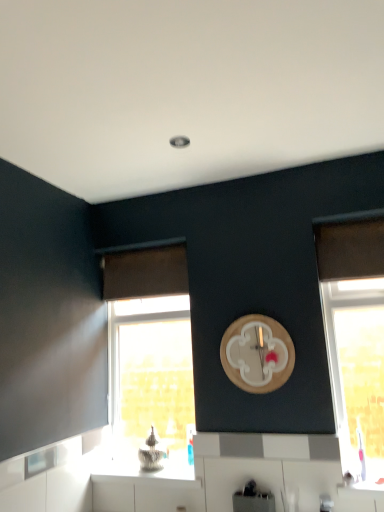
Question: Can you confirm if clear glass window at lower left, positioned as the first window in left-to-right order, is positioned to the left of metallic silver toaster at lower center?

Choices:
 (A) no
 (B) yes

Answer: (B)

Question: Does clear glass window at lower left, the second window positioned from the front, have a greater width compared to metallic silver toaster at lower center?

Choices:
 (A) no
 (B) yes

Answer: (A)

Question: From the image's perspective, is clear glass window at lower left, positioned as the first window in left-to-right order, over metallic silver toaster at lower center?

Choices:
 (A) no
 (B) yes

Answer: (B)

Question: Can you confirm if clear glass window at lower left, the second window positioned from the front, is shorter than metallic silver toaster at lower center?

Choices:
 (A) no
 (B) yes

Answer: (A)

Question: Is clear glass window at lower left, positioned as the first window in left-to-right order, to the right of metallic silver toaster at lower center from the viewer's perspective?

Choices:
 (A) no
 (B) yes

Answer: (A)

Question: Considering the positions of wooden clock at upper center and white glossy countertop at lower center in the image, is wooden clock at upper center bigger or smaller than white glossy countertop at lower center?

Choices:
 (A) big
 (B) small

Answer: (B)

Question: From the image's perspective, is wooden clock at upper center located above or below white glossy countertop at lower center?

Choices:
 (A) above
 (B) below

Answer: (A)

Question: In terms of width, does wooden clock at upper center look wider or thinner when compared to white glossy countertop at lower center?

Choices:
 (A) thin
 (B) wide

Answer: (A)

Question: From a real-world perspective, is wooden clock at upper center above or below white glossy countertop at lower center?

Choices:
 (A) below
 (B) above

Answer: (B)

Question: Considering the positions of clear glass window at lower left, positioned as the first window in left-to-right order, and brown fabric curtain at upper left in the image, is clear glass window at lower left, positioned as the first window in left-to-right order, bigger or smaller than brown fabric curtain at upper left?

Choices:
 (A) big
 (B) small

Answer: (A)

Question: From their relative heights in the image, would you say clear glass window at lower left, positioned as the first window in left-to-right order, is taller or shorter than brown fabric curtain at upper left?

Choices:
 (A) tall
 (B) short

Answer: (A)

Question: Considering the relative positions of clear glass window at lower left, marked as the first window in a back-to-front arrangement, and brown fabric curtain at upper left in the image provided, is clear glass window at lower left, marked as the first window in a back-to-front arrangement, to the left or to the right of brown fabric curtain at upper left?

Choices:
 (A) right
 (B) left

Answer: (A)

Question: Is clear glass window at lower left, which appears as the second window when viewed from the right, in front of or behind brown fabric curtain at upper left in the image?

Choices:
 (A) behind
 (B) front

Answer: (B)

Question: Is point (251, 483) closer or farther from the camera than point (345, 242)?

Choices:
 (A) farther
 (B) closer

Answer: (B)

Question: From a real-world perspective, is metallic silver toaster at lower center above or below translucent glass window at right, the 1th window in the front-to-back sequence?

Choices:
 (A) above
 (B) below

Answer: (B)